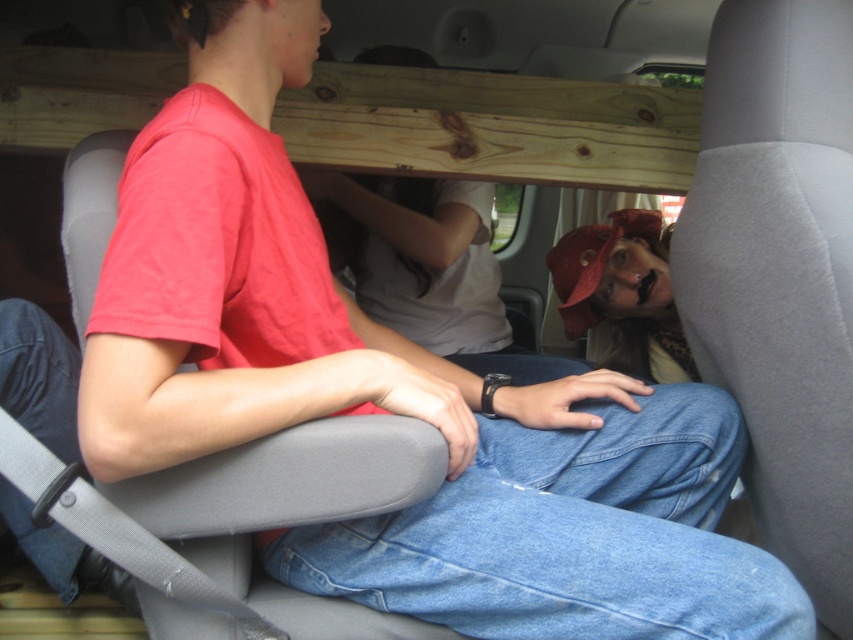
Question: Which point is farther to the camera?

Choices:
 (A) blue denim jeans at lower left
 (B) denim at center
 (C) matte red cap at center

Answer: (C)

Question: Is denim at center bigger than matte red cap at center?

Choices:
 (A) yes
 (B) no

Answer: (A)

Question: Which object appears farthest from the camera in this image?

Choices:
 (A) denim at center
 (B) blue denim jeans at lower left
 (C) matte red cap at center

Answer: (C)

Question: Does denim at center lie behind matte red cap at center?

Choices:
 (A) yes
 (B) no

Answer: (B)

Question: Is denim at center positioned at the back of matte red cap at center?

Choices:
 (A) yes
 (B) no

Answer: (B)

Question: Which point is farther to the camera?

Choices:
 (A) (665, 593)
 (B) (30, 317)

Answer: (B)